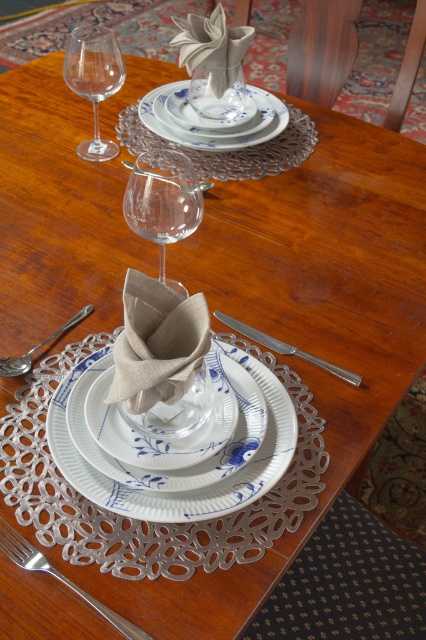
Question: Is transparent glass wine glass at center to the right of shiny silver spoon at upper center from the viewer's perspective?

Choices:
 (A) yes
 (B) no

Answer: (A)

Question: Does blue and white porcelain saucer at center have a greater width compared to blue porcelain plate at center?

Choices:
 (A) no
 (B) yes

Answer: (A)

Question: Based on their relative distances, which object is nearer to the shiny silver spoon at upper center?

Choices:
 (A) satin silver spoon at lower left
 (B) white porcelain plate at center
 (C) transparent glass wine glass at center
 (D) silver metallic knife at center

Answer: (C)

Question: Which point is closer to the camera?

Choices:
 (A) transparent glass wine glass at upper left
 (B) silver metallic knife at center
 (C) blue porcelain saucer at center
 (D) blue and white porcelain saucer at center

Answer: (D)

Question: Estimate the real-world distances between objects in this image. Which object is closer to the silver metallic fork at lower left?

Choices:
 (A) blue and white porcelain saucer at center
 (B) transparent glass wine glass at upper left
 (C) shiny silver spoon at upper center

Answer: (A)

Question: Is silver metallic fork at lower left closer to the viewer compared to shiny silver spoon at upper center?

Choices:
 (A) no
 (B) yes

Answer: (B)